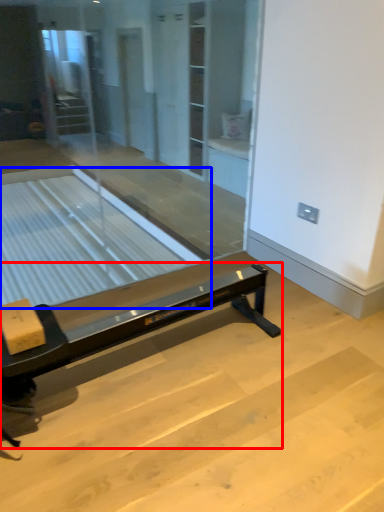
Question: Which object appears farthest to the camera in this image, furniture (highlighted by a red box) or table (highlighted by a blue box)?

Choices:
 (A) furniture
 (B) table

Answer: (B)